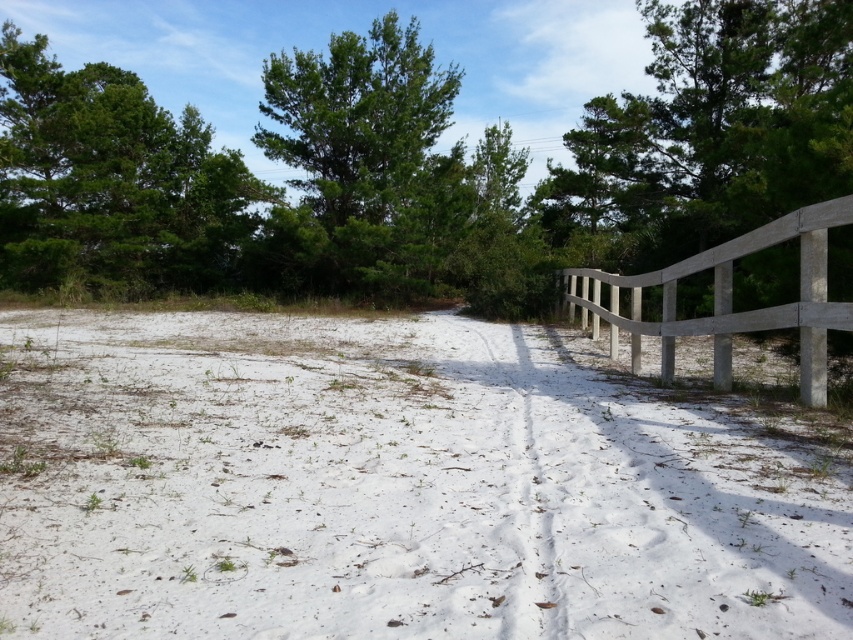
You are planning to walk along the white sandy path at center. Considering the position of the green leafy tree at upper center, where would you expect to find shade while walking?

The white sandy path at center is positioned under the green leafy tree at upper center, so shade would be available along the path directly beneath the tree.

You are standing at the starting point of the sandy path and want to reach a destination located at point (575, 228). There is an obstacle at point (192, 184) blocking your path. Can you safely navigate around the obstacle to reach your destination?

Yes, you can safely navigate around the obstacle because point (575, 228) is behind point (192, 184), meaning the destination is positioned further back relative to the obstacle, allowing you to move around it along the path.